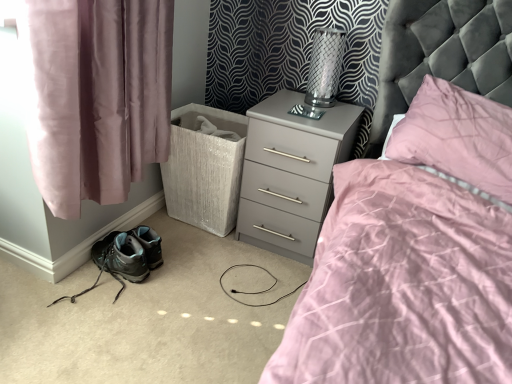
The height and width of the screenshot is (384, 512). In order to click on unoccupied area in front of matte gray hiking boots at lower left in this screenshot , I will do `click(68, 345)`.